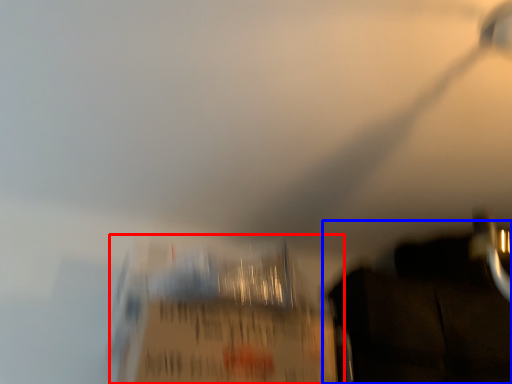
Question: Which object is further to the camera taking this photo, cardboard box (highlighted by a red box) or dark (highlighted by a blue box)?

Choices:
 (A) cardboard box
 (B) dark

Answer: (B)